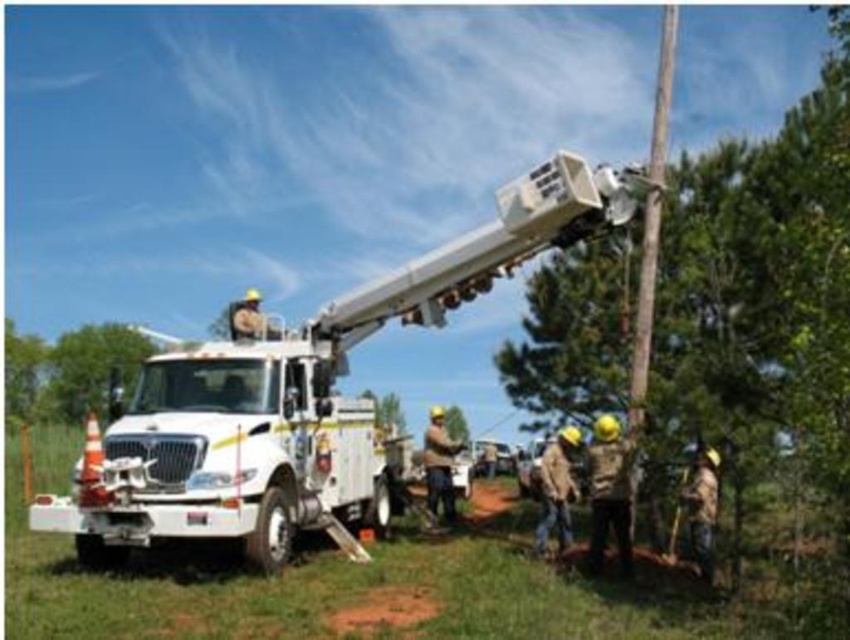
Is white metallic bucket truck at center thinner than green leafy tree at lower left?

In fact, white metallic bucket truck at center might be wider than green leafy tree at lower left.

Is point (264, 372) less distant than point (23, 368)?

Yes, it is in front of point (23, 368).

Locate an element on the screen. The image size is (850, 640). white metallic bucket truck at center is located at coordinates (306, 392).

Which is below, green textured tree at center or white metallic bucket truck at center?

white metallic bucket truck at center is below.

Consider the image. Who is more distant from viewer, (814, 417) or (74, 481)?

Point (74, 481)

You are a GUI agent. You are given a task and a screenshot of the screen. Output one action in this format:
    pyautogui.click(x=<x>, y=<y>)
    Task: Click on the green textured tree at center
    Image resolution: width=850 pixels, height=640 pixels.
    Given the screenshot: What is the action you would take?
    pyautogui.click(x=765, y=333)

Which is above, green textured tree at center or brown leather gloves at center?

green textured tree at center

Does green textured tree at center have a greater width compared to brown leather gloves at center?

Indeed, green textured tree at center has a greater width compared to brown leather gloves at center.

Image resolution: width=850 pixels, height=640 pixels. What do you see at coordinates (765, 333) in the screenshot? I see `green textured tree at center` at bounding box center [765, 333].

At what (x,y) coordinates should I click in order to perform the action: click on green textured tree at center. Please return your answer as a coordinate pair (x, y). Looking at the image, I should click on (765, 333).